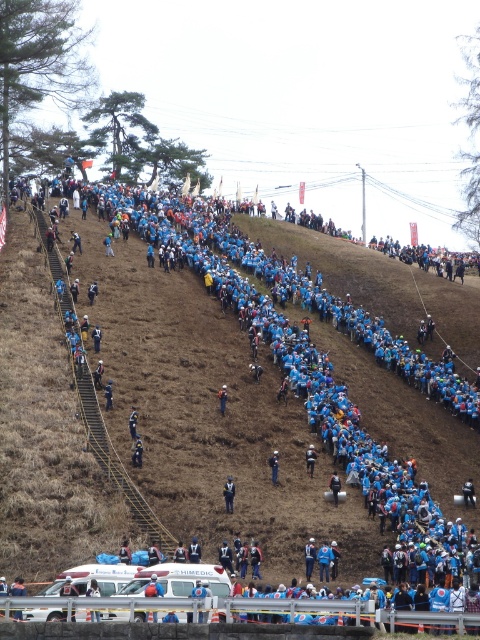
Is blue fabric jacket at center smaller than blue fabric backpack at center?

Incorrect, blue fabric jacket at center is not smaller in size than blue fabric backpack at center.

Image resolution: width=480 pixels, height=640 pixels. What do you see at coordinates (228, 493) in the screenshot? I see `blue fabric jacket at center` at bounding box center [228, 493].

Is point (225, 486) positioned before point (276, 480)?

Yes, it is in front of point (276, 480).

In order to click on blue fabric jacket at center in this screenshot , I will do `click(228, 493)`.

Does point (192, 552) come in front of point (223, 387)?

Yes, point (192, 552) is in front of point (223, 387).

Is blue fabric person at upper center to the right of orange fabric at center from the viewer's perspective?

In fact, blue fabric person at upper center is to the left of orange fabric at center.

At what (x,y) coordinates should I click in order to perform the action: click on blue fabric person at upper center. Please return your answer as a coordinate pair (x, y). This screenshot has width=480, height=640. Looking at the image, I should click on (317, 369).

Measure the distance from blue fabric jacket at center to orange fabric at center.

blue fabric jacket at center and orange fabric at center are 12.82 meters apart.

Can you confirm if blue fabric jacket at center is thinner than orange fabric at center?

No, blue fabric jacket at center is not thinner than orange fabric at center.

Between point (226, 486) and point (222, 396), which one is positioned behind?

Positioned behind is point (222, 396).

I want to click on blue fabric jacket at center, so click(x=228, y=493).